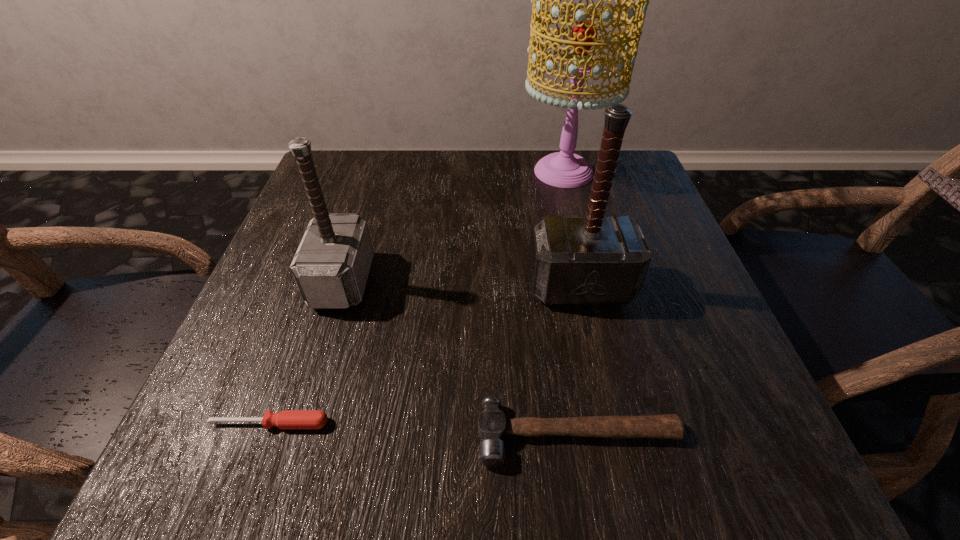
Identify the location of object at the near right corner. (492, 425).

In the image, there is a desktop. Identify the location of vacant area at the far edge. This screenshot has width=960, height=540. (456, 176).

Identify the location of vacant area at the near edge. This screenshot has width=960, height=540. (517, 442).

In the image, there is a desktop. Where is `free region at the left edge`? free region at the left edge is located at coordinates (317, 327).

In the image, there is a desktop. In order to click on free space at the right edge in this screenshot , I will do `click(621, 207)`.

I want to click on vacant space at the far left corner of the desktop, so click(359, 162).

Identify the location of vacant space at the near left corner of the desktop. The image size is (960, 540). (186, 480).

You are a GUI agent. You are given a task and a screenshot of the screen. Output one action in this format:
    pyautogui.click(x=<x>, y=<y>)
    Task: Click on the free point at the far right corner
    The image size is (960, 540).
    Given the screenshot: What is the action you would take?
    pyautogui.click(x=654, y=190)

Find the location of a particular element. The width and height of the screenshot is (960, 540). vacant space at the near right corner of the desktop is located at coordinates (719, 441).

What are the coordinates of `empty space that is in between the tallest object and the screwdriver` in the screenshot? It's located at (418, 298).